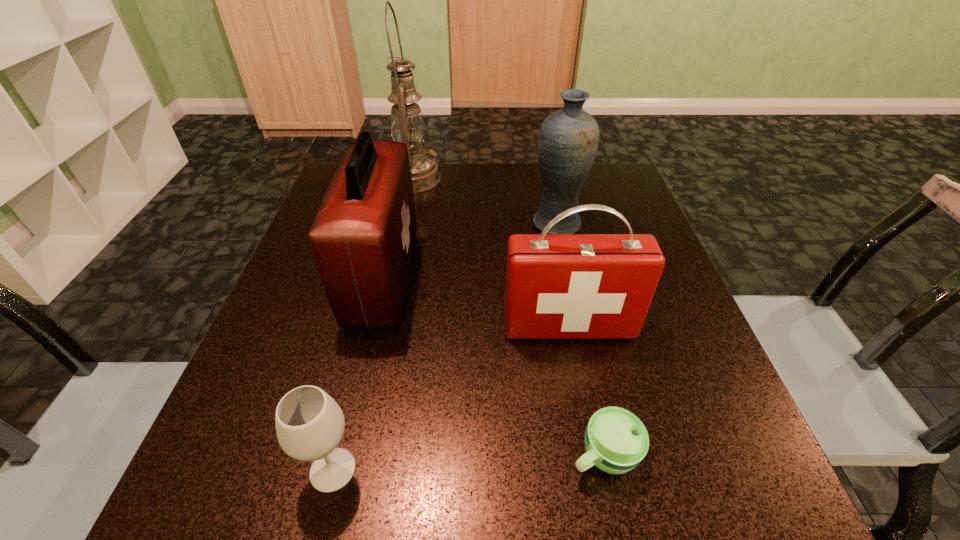
This screenshot has height=540, width=960. What are the coordinates of `vase that is positioned at the right edge` in the screenshot? It's located at (568, 139).

At what (x,y) coordinates should I click in order to perform the action: click on the first-aid kit present at the right edge. Please return your answer as a coordinate pair (x, y). The height and width of the screenshot is (540, 960). Looking at the image, I should click on (558, 286).

Where is `cup positioned at the right edge`? The height and width of the screenshot is (540, 960). cup positioned at the right edge is located at coordinates (616, 441).

The width and height of the screenshot is (960, 540). I want to click on object that is at the far left corner, so click(x=407, y=126).

You are a GUI agent. You are given a task and a screenshot of the screen. Output one action in this format:
    pyautogui.click(x=<x>, y=<y>)
    Task: Click on the object that is positioned at the near left corner
    
    Given the screenshot: What is the action you would take?
    pyautogui.click(x=309, y=423)

Locate an element on the screen. Image resolution: width=960 pixels, height=540 pixels. object at the far right corner is located at coordinates (568, 139).

Locate an element on the screen. The image size is (960, 540). object situated at the near right corner is located at coordinates (616, 441).

Locate an element on the screen. free space at the far edge of the desktop is located at coordinates (450, 214).

I want to click on vacant region at the left edge, so click(x=258, y=340).

Where is `vacant space at the right edge`? The width and height of the screenshot is (960, 540). vacant space at the right edge is located at coordinates (639, 402).